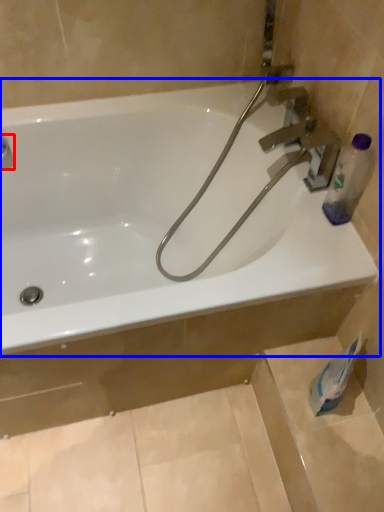
Question: Which object is closer to the camera taking this photo, plumbing fixture (highlighted by a red box) or bathtub (highlighted by a blue box)?

Choices:
 (A) plumbing fixture
 (B) bathtub

Answer: (B)